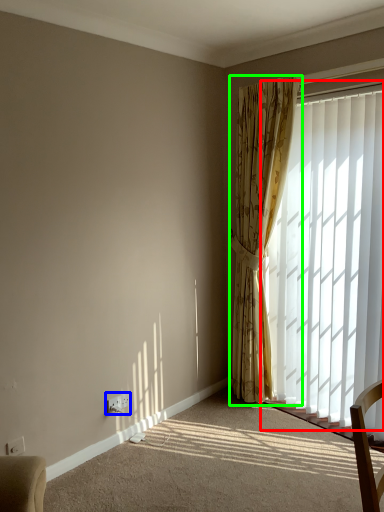
Question: Which object is positioned closest to window (highlighted by a red box)? Select from electric outlet (highlighted by a blue box) and curtain (highlighted by a green box).

Choices:
 (A) electric outlet
 (B) curtain

Answer: (B)